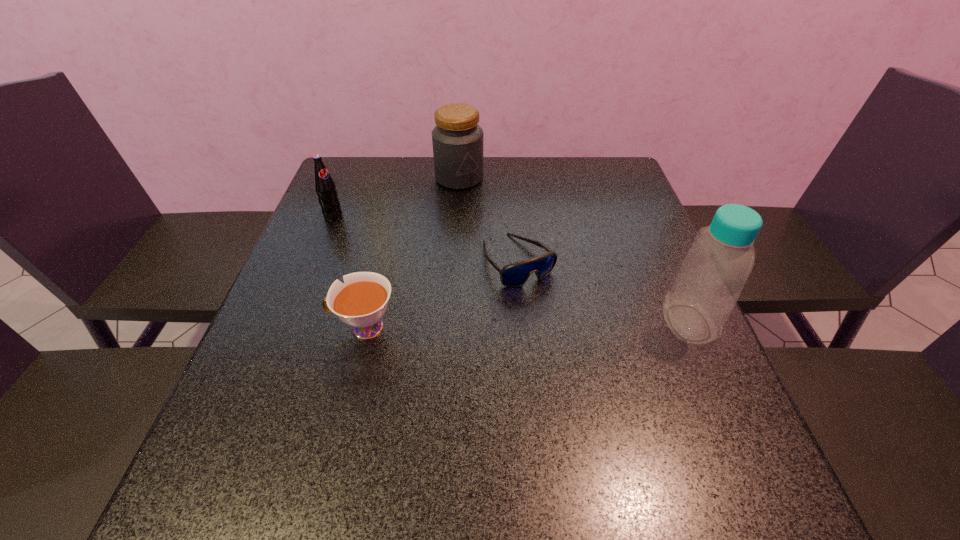
Find the location of a particular element. free spot between the jar and the rightmost object is located at coordinates (574, 251).

What are the coordinates of `object identified as the fourth closest to the rightmost object` in the screenshot? It's located at coord(325,187).

Identify which object is the third closest to the third farthest object. Please provide its 2D coordinates. Your answer should be formatted as a tuple, i.e. [(x, y)], where the tuple contains the x and y coordinates of a point satisfying the conditions above.

[(712, 275)]

The width and height of the screenshot is (960, 540). What are the coordinates of `vacant space that satisfies the following two spatial constraints: 1. on the front side of the leftmost object; 2. on the right side of the shortest object` in the screenshot? It's located at (316, 260).